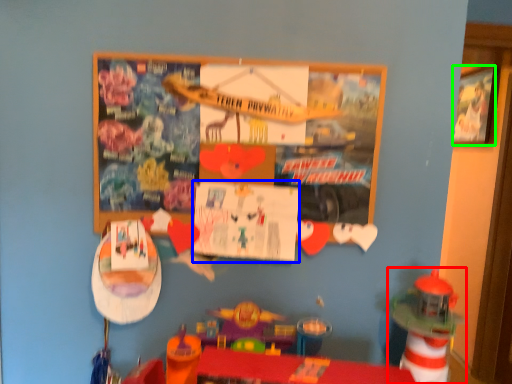
Question: Based on their relative distances, which object is farther from toy (highlighted by a red box)? Choose from poster page (highlighted by a blue box) and picture frame (highlighted by a green box).

Choices:
 (A) poster page
 (B) picture frame

Answer: (B)